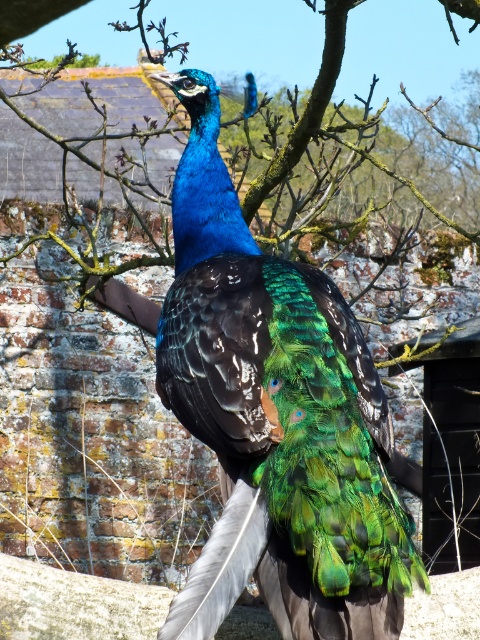
You are standing in front of a peacock perched on a tree branch in a rustic setting. The peacock has a shiny blue neck and head, and its feathers shimmer with green, blue, and gold. You notice a specific point at coordinates point (282, 403). Is the shiny blue peacock at center located at that point?

Yes, the shiny blue peacock at center is located at point (282, 403).

You are standing in a garden and see the shiny blue peacock at center and the green leafy tree at center. Which one is taller?

The shiny blue peacock at center is shorter than the green leafy tree at center, so the green leafy tree at center is taller.

You are a birdwatcher observing the scene. You notice the shiny blue peacock at center and the green leafy tree at center. Which object is positioned higher in the image?

The green leafy tree at center is positioned higher than the shiny blue peacock at center.